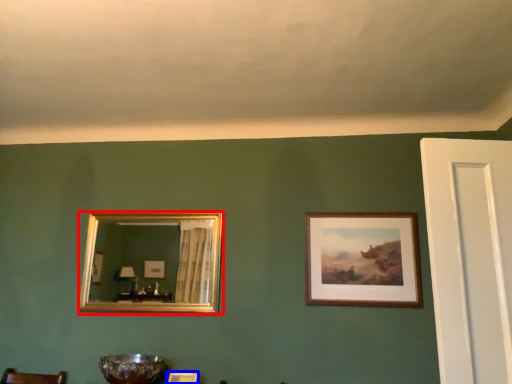
Question: Among these objects, which one is nearest to the camera, picture frame (highlighted by a red box) or picture frame (highlighted by a blue box)?

Choices:
 (A) picture frame
 (B) picture frame

Answer: (B)